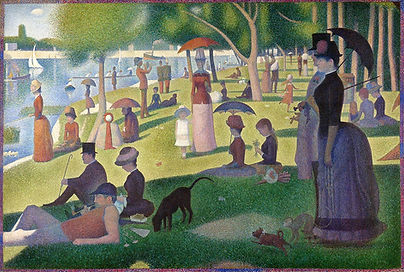
Identify the location of painting. The width and height of the screenshot is (404, 272). (381, 31).